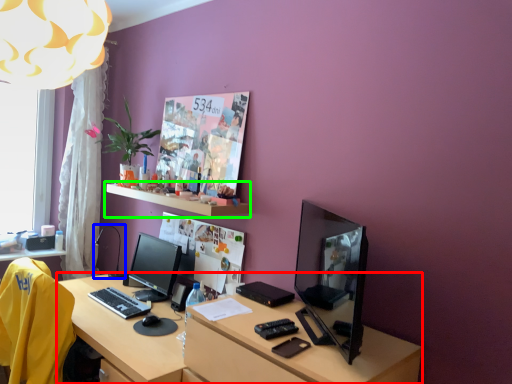
Question: Considering the real-world distances, which object is closest to desk (highlighted by a red box)? table lamp (highlighted by a blue box) or shelf (highlighted by a green box).

Choices:
 (A) table lamp
 (B) shelf

Answer: (B)